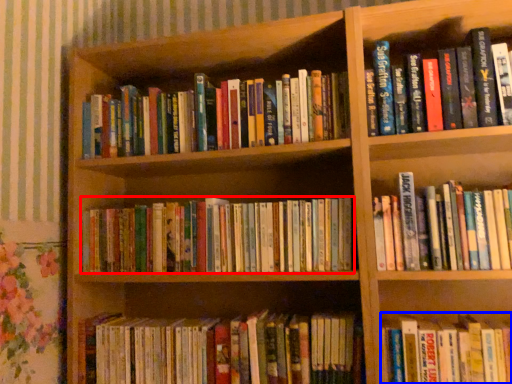
Question: Which of the following is the closest to the observer, book (highlighted by a red box) or book (highlighted by a blue box)?

Choices:
 (A) book
 (B) book

Answer: (B)